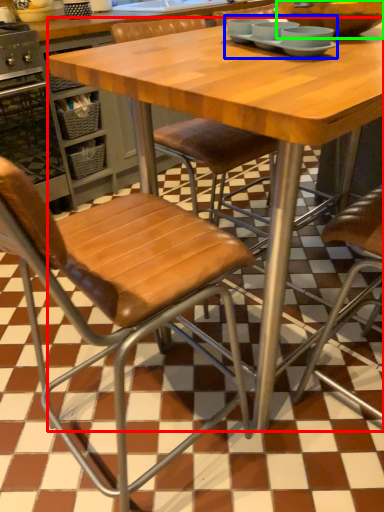
Question: Estimate the real-world distances between objects in this image. Which object is closer to table (highlighted by a red box), tableware (highlighted by a blue box) or bowl (highlighted by a green box)?

Choices:
 (A) tableware
 (B) bowl

Answer: (A)